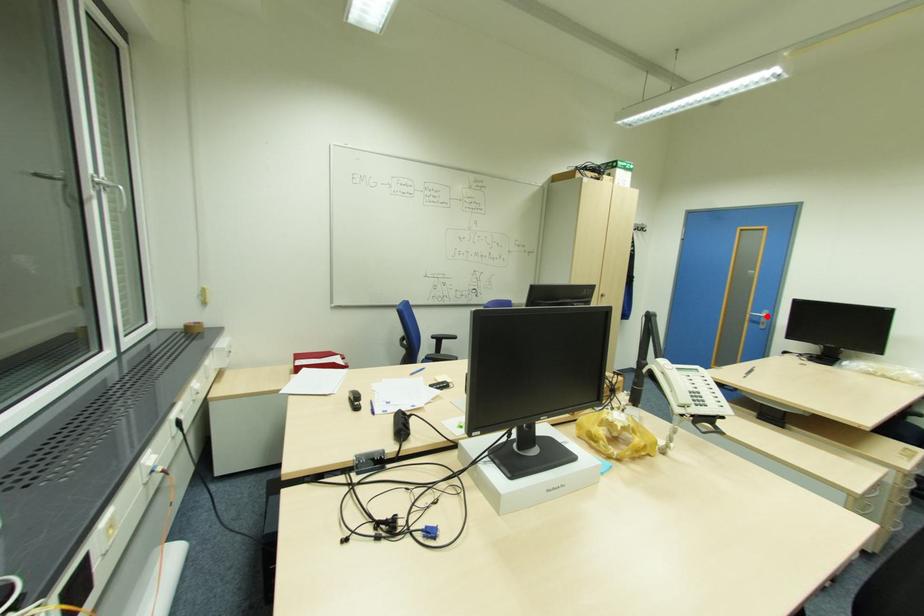
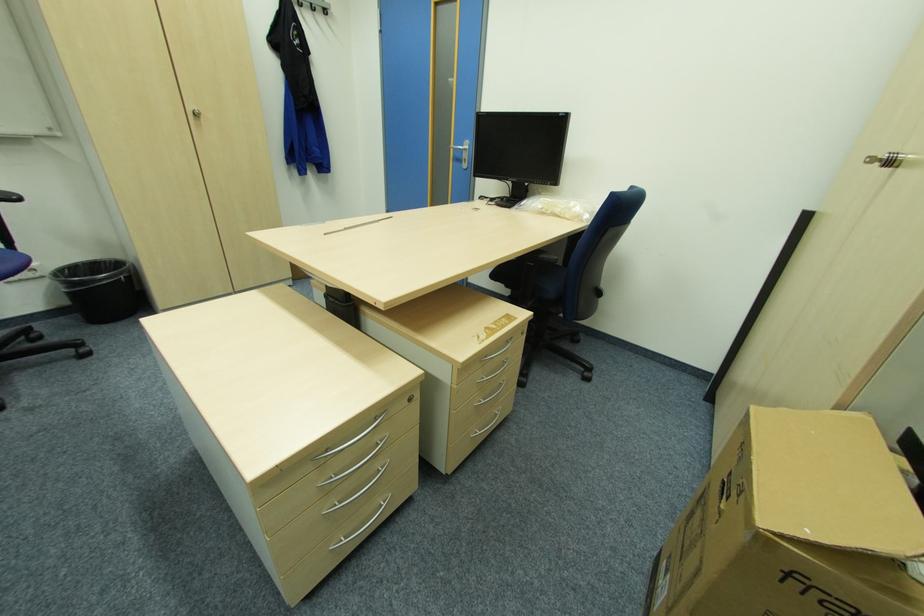
Question: I am providing you with two images of the same scene from different viewpoints. Given a red point in image1, look at the same physical point in image2. Is it:

Choices:
 (A) Closer to the viewpoint
 (B) Farther from the viewpoint

Answer: (A)